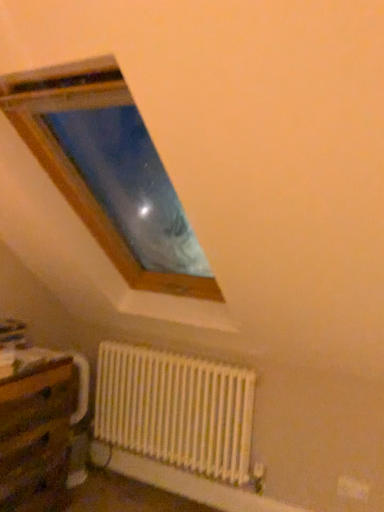
Question: Considering the relative sizes of white matte radiator at lower center and wooden table at lower left in the image provided, is white matte radiator at lower center taller than wooden table at lower left?

Choices:
 (A) yes
 (B) no

Answer: (B)

Question: Is white matte radiator at lower center not near wooden table at lower left?

Choices:
 (A) no
 (B) yes

Answer: (A)

Question: Considering the relative sizes of white matte radiator at lower center and wooden table at lower left in the image provided, is white matte radiator at lower center smaller than wooden table at lower left?

Choices:
 (A) no
 (B) yes

Answer: (B)

Question: Is white matte radiator at lower center to the left of wooden table at lower left from the viewer's perspective?

Choices:
 (A) no
 (B) yes

Answer: (A)

Question: Is white matte radiator at lower center directly adjacent to wooden table at lower left?

Choices:
 (A) yes
 (B) no

Answer: (B)

Question: Does white matte radiator at lower center come in front of wooden table at lower left?

Choices:
 (A) yes
 (B) no

Answer: (B)

Question: Is wooden table at lower left facing away from white matte radiator at lower center?

Choices:
 (A) no
 (B) yes

Answer: (A)

Question: Can you confirm if wooden table at lower left is taller than white matte radiator at lower center?

Choices:
 (A) yes
 (B) no

Answer: (A)

Question: Is wooden table at lower left outside white matte radiator at lower center?

Choices:
 (A) no
 (B) yes

Answer: (B)

Question: Considering the relative sizes of wooden table at lower left and white matte radiator at lower center in the image provided, is wooden table at lower left thinner than white matte radiator at lower center?

Choices:
 (A) yes
 (B) no

Answer: (B)

Question: From the image's perspective, is wooden table at lower left beneath white matte radiator at lower center?

Choices:
 (A) no
 (B) yes

Answer: (B)

Question: Is wooden table at lower left facing towards white matte radiator at lower center?

Choices:
 (A) yes
 (B) no

Answer: (B)

Question: Considering their positions, is white matte radiator at lower center located in front of or behind wooden table at lower left?

Choices:
 (A) front
 (B) behind

Answer: (B)